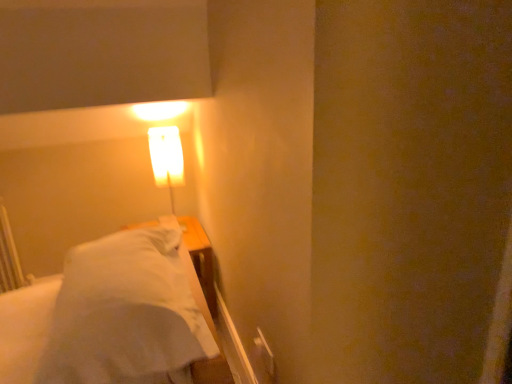
Question: Is the surface of matte white lamp at upper left in direct contact with white soft bed at left?

Choices:
 (A) no
 (B) yes

Answer: (A)

Question: Does matte white lamp at upper left have a lesser height compared to white soft bed at left?

Choices:
 (A) yes
 (B) no

Answer: (B)

Question: Can you confirm if matte white lamp at upper left is bigger than white soft bed at left?

Choices:
 (A) no
 (B) yes

Answer: (A)

Question: Can you confirm if matte white lamp at upper left is wider than white soft bed at left?

Choices:
 (A) yes
 (B) no

Answer: (B)

Question: Is matte white lamp at upper left not within white soft bed at left?

Choices:
 (A) no
 (B) yes

Answer: (B)

Question: Does matte white lamp at upper left appear on the left side of white soft bed at left?

Choices:
 (A) no
 (B) yes

Answer: (B)

Question: Is white soft bed at left turned away from matte white lamp at upper left?

Choices:
 (A) no
 (B) yes

Answer: (A)

Question: Is white soft bed at left closer to camera compared to matte white lamp at upper left?

Choices:
 (A) yes
 (B) no

Answer: (A)

Question: From the image's perspective, is white soft bed at left under matte white lamp at upper left?

Choices:
 (A) yes
 (B) no

Answer: (A)

Question: Is white soft bed at left to the right of matte white lamp at upper left from the viewer's perspective?

Choices:
 (A) yes
 (B) no

Answer: (A)

Question: Is white soft bed at left located outside matte white lamp at upper left?

Choices:
 (A) yes
 (B) no

Answer: (A)

Question: Does white soft bed at left have a larger size compared to matte white lamp at upper left?

Choices:
 (A) yes
 (B) no

Answer: (A)

Question: From their relative heights in the image, would you say white soft bed at left is taller or shorter than matte white lamp at upper left?

Choices:
 (A) tall
 (B) short

Answer: (B)